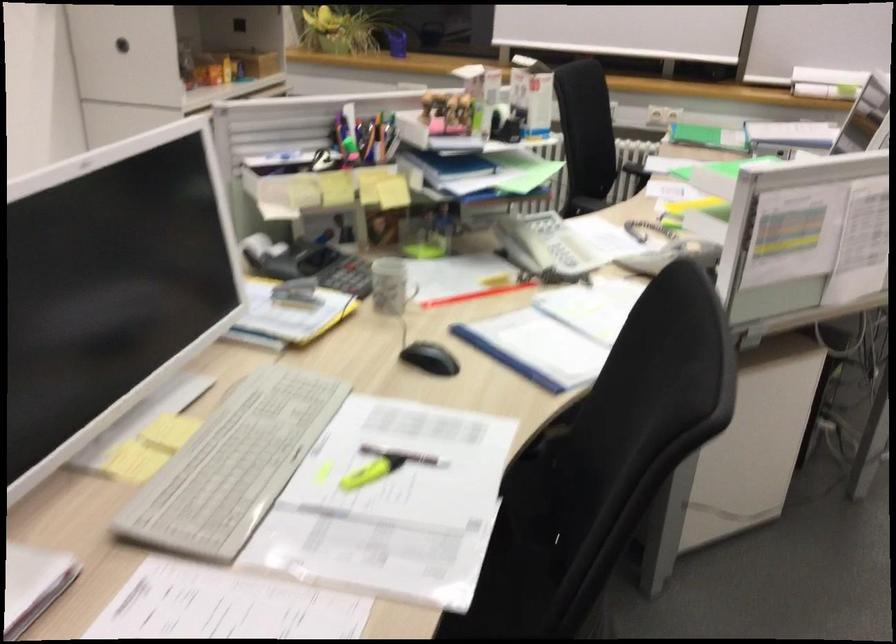
Identify the location of yellow highlighter pen. (372, 471).